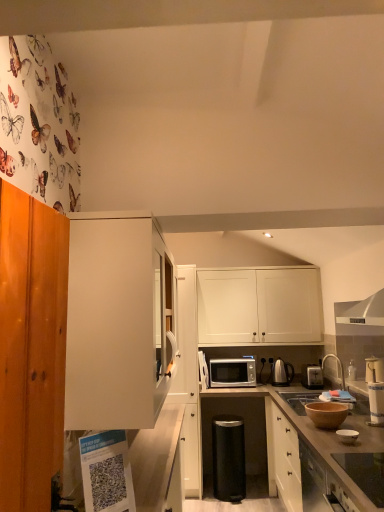
Question: Is smooth glass cooktop at lower right, arranged as the fifth appliance when viewed from the back, thinner than silver metallic faucet at upper right?

Choices:
 (A) yes
 (B) no

Answer: (B)

Question: Are smooth glass cooktop at lower right, acting as the 4th appliance starting from the right, and silver metallic faucet at upper right located far from each other?

Choices:
 (A) no
 (B) yes

Answer: (B)

Question: Considering the relative sizes of smooth glass cooktop at lower right, arranged as the fifth appliance when viewed from the back, and silver metallic faucet at upper right in the image provided, is smooth glass cooktop at lower right, arranged as the fifth appliance when viewed from the back, wider than silver metallic faucet at upper right?

Choices:
 (A) no
 (B) yes

Answer: (B)

Question: Considering the relative sizes of smooth glass cooktop at lower right, acting as the 4th appliance starting from the right, and silver metallic faucet at upper right in the image provided, is smooth glass cooktop at lower right, acting as the 4th appliance starting from the right, taller than silver metallic faucet at upper right?

Choices:
 (A) yes
 (B) no

Answer: (B)

Question: Does smooth glass cooktop at lower right, which is the 2th appliance from top to bottom, have a larger size compared to silver metallic faucet at upper right?

Choices:
 (A) no
 (B) yes

Answer: (A)

Question: From the image's perspective, relative to silver metallic faucet at upper right, is black metallic trash can at center, marked as the 1th appliance in a bottom-to-top arrangement, above or below?

Choices:
 (A) above
 (B) below

Answer: (B)

Question: Is black metallic trash can at center, the 4th appliance positioned from the front, wider or thinner than silver metallic faucet at upper right?

Choices:
 (A) thin
 (B) wide

Answer: (B)

Question: Is point (241, 483) positioned closer to the camera than point (342, 370)?

Choices:
 (A) farther
 (B) closer

Answer: (B)

Question: Choose the correct answer: Is black metallic trash can at center, the 4th appliance positioned from the front, inside silver metallic faucet at upper right or outside it?

Choices:
 (A) outside
 (B) inside

Answer: (A)

Question: Is point (274, 369) closer or farther from the camera than point (375, 489)?

Choices:
 (A) closer
 (B) farther

Answer: (B)

Question: From the image's perspective, is metallic electric kettle at center-right, positioned as the 5th appliance in front-to-back order, positioned above or below smooth glass cooktop at lower right, positioned as the second appliance in left-to-right order?

Choices:
 (A) above
 (B) below

Answer: (B)

Question: Is metallic electric kettle at center-right, positioned as the 5th appliance in front-to-back order, wider or thinner than smooth glass cooktop at lower right, arranged as the fifth appliance when viewed from the back?

Choices:
 (A) wide
 (B) thin

Answer: (B)

Question: Do you think metallic electric kettle at center-right, the 1th appliance when ordered from back to front, is within smooth glass cooktop at lower right, acting as the 4th appliance starting from the right, or outside of it?

Choices:
 (A) outside
 (B) inside

Answer: (A)

Question: Is white matte cabinet at center, the second cabinetry viewed from the right, to the left or to the right of silver metallic faucet at upper right in the image?

Choices:
 (A) right
 (B) left

Answer: (B)

Question: Considering the positions of point (173, 392) and point (342, 375), is point (173, 392) closer or farther from the camera than point (342, 375)?

Choices:
 (A) closer
 (B) farther

Answer: (A)